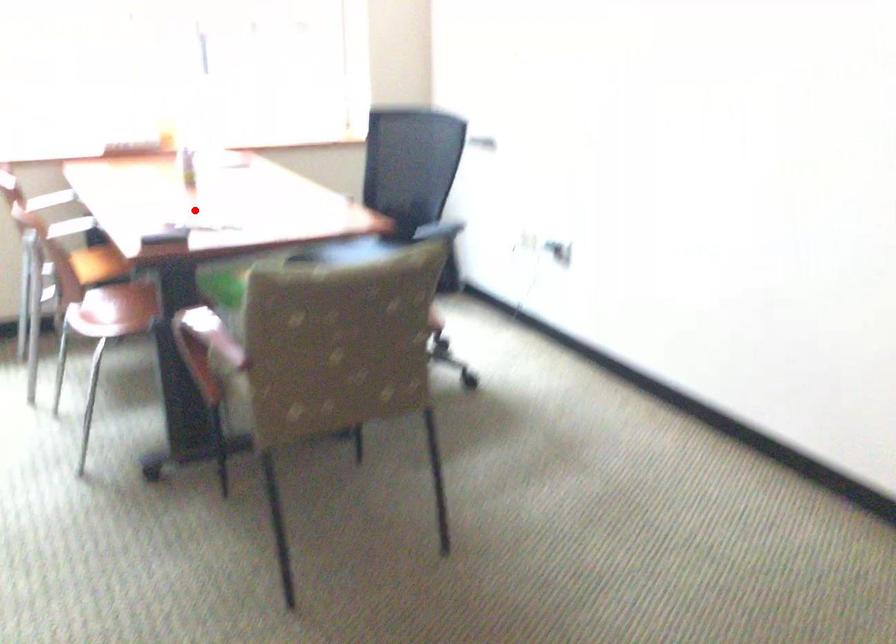
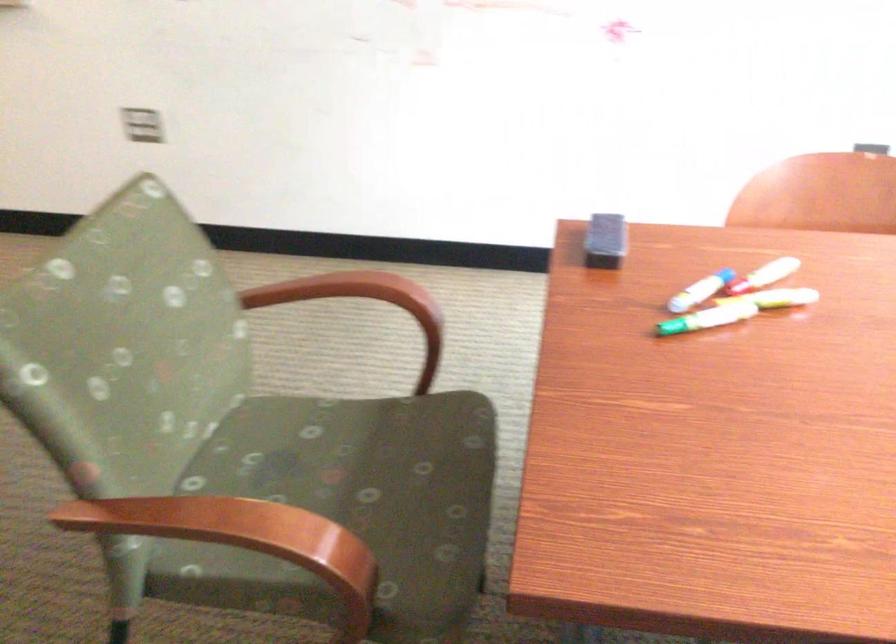
Locate, in the second image, the point that corresponds to the highlighted location in the first image.

(776, 298)